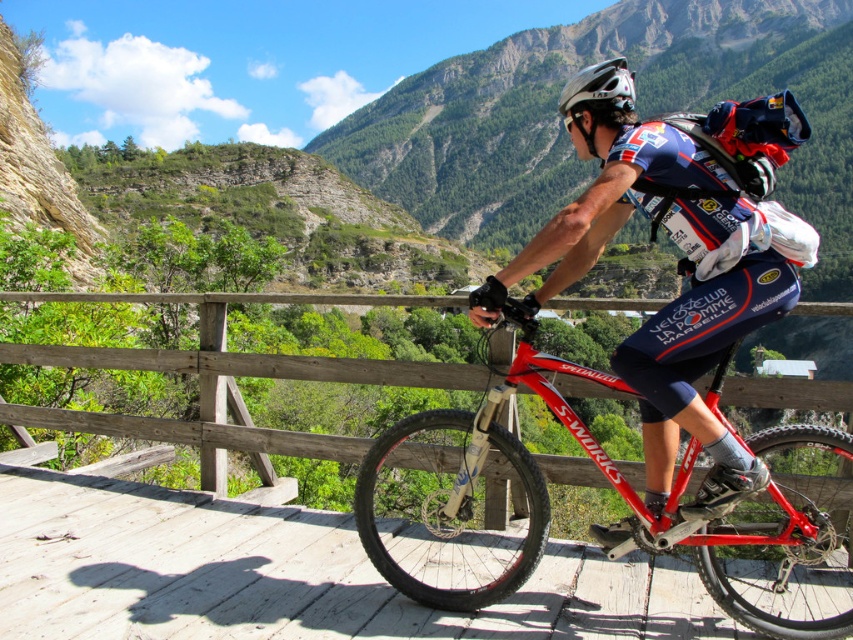
Question: Which object is the closest to the shiny red frame at center?

Choices:
 (A) white matte helmet at upper center
 (B) red matte bicycle at center

Answer: (B)

Question: Can you confirm if shiny red frame at center is bigger than white matte helmet at upper center?

Choices:
 (A) yes
 (B) no

Answer: (A)

Question: From the image, what is the correct spatial relationship of shiny red frame at center in relation to red matte bicycle at center?

Choices:
 (A) right
 (B) left

Answer: (A)

Question: Is shiny red frame at center in front of red matte bicycle at center?

Choices:
 (A) no
 (B) yes

Answer: (A)

Question: Which of the following is the closest to the observer?

Choices:
 (A) white matte helmet at upper center
 (B) red matte bicycle at center
 (C) shiny red frame at center

Answer: (B)

Question: Considering the real-world distances, which object is farthest from the white matte helmet at upper center?

Choices:
 (A) red matte bicycle at center
 (B) shiny red frame at center

Answer: (B)